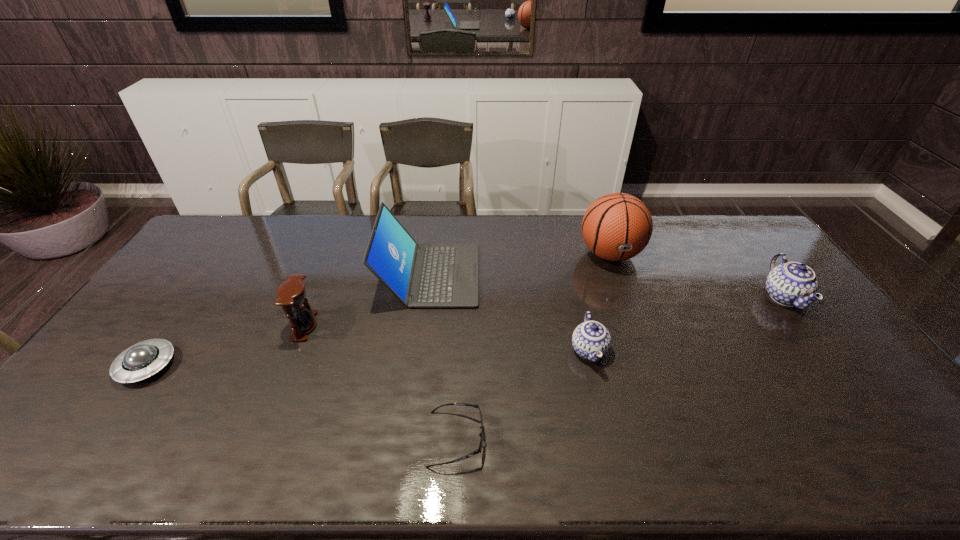
The width and height of the screenshot is (960, 540). What are the coordinates of `the shortest object` in the screenshot? It's located at (479, 450).

Image resolution: width=960 pixels, height=540 pixels. I want to click on free space located on the side where the inflation valve is located, so click(x=642, y=343).

I want to click on free space located 0.080m on the screen of the laptop computer, so click(x=502, y=275).

Identify the location of free spot located on the back of the sixth object from right to left. The height and width of the screenshot is (540, 960). (317, 293).

The width and height of the screenshot is (960, 540). I want to click on vacant space located 0.140m at the spout of the farther chinaware, so click(x=719, y=298).

Locate an element on the screen. free region located 0.170m at the spout of the farther chinaware is located at coordinates (709, 298).

You are a GUI agent. You are given a task and a screenshot of the screen. Output one action in this format:
    pyautogui.click(x=<x>, y=<y>)
    Task: Click on the vacant region located at the spout of the farther chinaware
    This screenshot has width=960, height=540.
    Given the screenshot: What is the action you would take?
    pyautogui.click(x=660, y=298)

Locate an element on the screen. vacant area situated 0.210m at the spout of the shorter chinaware is located at coordinates (612, 450).

At what (x,y) coordinates should I click in order to perform the action: click on vacant space located 0.370m on the right of the saucer. Please return your answer as a coordinate pair (x, y). The width and height of the screenshot is (960, 540). Looking at the image, I should click on (309, 366).

This screenshot has height=540, width=960. I want to click on vacant space located on the front-facing side of the nearest object, so click(x=622, y=438).